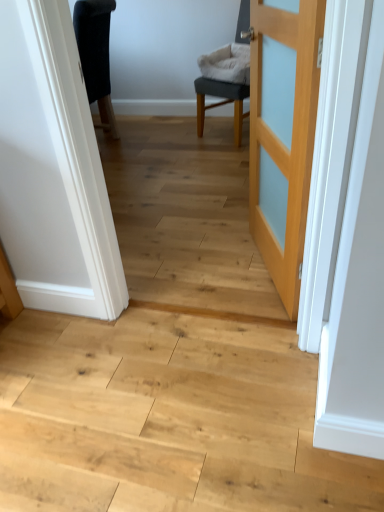
From the picture: What is the approximate height of natural wood floor at center?

1.49 inches.

I want to click on light wood door at center, so click(x=283, y=135).

The width and height of the screenshot is (384, 512). What are the coordinates of `gray fabric chair at center` in the screenshot? It's located at (221, 102).

Find the location of a particular element. The height and width of the screenshot is (512, 384). chair above the natural wood floor at center (from a real-world perspective) is located at coordinates (221, 102).

From a real-world perspective, is natural wood floor at center physically below gray fabric chair at center?

Yes, from a real-world perspective, natural wood floor at center is below gray fabric chair at center.

Considering their positions, is natural wood floor at center located in front of or behind gray fabric chair at center?

natural wood floor at center is in front of gray fabric chair at center.

How different are the orientations of natural wood floor at center and gray fabric chair at center in degrees?

They differ by 27.7 degrees in their facing directions.

Is the surface of natural wood floor at center in direct contact with light wood door at center?

natural wood floor at center is not next to light wood door at center, and they're not touching.

What's the angular difference between natural wood floor at center and light wood door at center's facing directions?

The facing directions of natural wood floor at center and light wood door at center are 67.3 degrees apart.

Who is taller, natural wood floor at center or light wood door at center?

Standing taller between the two is light wood door at center.

Is natural wood floor at center looking in the opposite direction of light wood door at center?

No.

Looking at this image, which of these two, gray fabric chair at center or light wood door at center, stands taller?

light wood door at center is taller.

Is gray fabric chair at center bigger than light wood door at center?

Yes, gray fabric chair at center is bigger than light wood door at center.

Is gray fabric chair at center touching light wood door at center?

No, gray fabric chair at center is not touching light wood door at center.

Which is closer, (236,98) or (312,74)?

Point (236,98).

This screenshot has height=512, width=384. I want to click on door located on the left of gray fabric chair at center, so click(x=283, y=135).

Measure the distance from light wood door at center to gray fabric chair at center.

The distance of light wood door at center from gray fabric chair at center is 1.58 meters.

From a real-world perspective, relative to gray fabric chair at center, is light wood door at center vertically above or below?

From a real-world perspective, light wood door at center is physically above gray fabric chair at center.

Who is bigger, gray fabric chair at center or natural wood floor at center?

Bigger between the two is gray fabric chair at center.

Can you confirm if gray fabric chair at center is taller than natural wood floor at center?

Correct, gray fabric chair at center is much taller as natural wood floor at center.

Is gray fabric chair at center turned away from natural wood floor at center?

No, gray fabric chair at center is not facing the opposite direction of natural wood floor at center.

How many degrees apart are the facing directions of gray fabric chair at center and natural wood floor at center?

27.7 degrees separate the facing orientations of gray fabric chair at center and natural wood floor at center.

Is light wood door at center next to natural wood floor at center?

No, light wood door at center is not beside natural wood floor at center.

At what (x,y) coordinates should I click in order to perform the action: click on door that is on the right side of natural wood floor at center. Please return your answer as a coordinate pair (x, y). This screenshot has width=384, height=512. Looking at the image, I should click on (283, 135).

Which is nearer, (258, 28) or (231, 466)?

Point (258, 28) appears to be farther away from the viewer than point (231, 466).

Between light wood door at center and natural wood floor at center, which one has smaller width?

light wood door at center.

This screenshot has width=384, height=512. Identify the location of stairwell below the gray fabric chair at center (from a real-world perspective). (166, 418).

The image size is (384, 512). In the image, there is a light wood door at center. Identify the location of stairwell below it (from the image's perspective). 166,418.

Considering their positions, is light wood door at center positioned closer to natural wood floor at center than gray fabric chair at center?

Based on the image, light wood door at center appears to be nearer to natural wood floor at center.

Estimate the real-world distances between objects in this image. Which object is further from light wood door at center, natural wood floor at center or gray fabric chair at center?

gray fabric chair at center.

Looking at the image, which one is located further to light wood door at center, gray fabric chair at center or natural wood floor at center?

gray fabric chair at center is positioned further to the anchor light wood door at center.

Looking at this image, based on their spatial positions, is natural wood floor at center or light wood door at center closer to gray fabric chair at center?

light wood door at center.

Looking at the image, which one is located closer to natural wood floor at center, gray fabric chair at center or light wood door at center?

light wood door at center is positioned closer to the anchor natural wood floor at center.

Considering their positions, is light wood door at center positioned closer to gray fabric chair at center than natural wood floor at center?

light wood door at center lies closer to gray fabric chair at center than the other object.

Where is `door between natural wood floor at center and gray fabric chair at center along the z-axis`? door between natural wood floor at center and gray fabric chair at center along the z-axis is located at coordinates (283, 135).